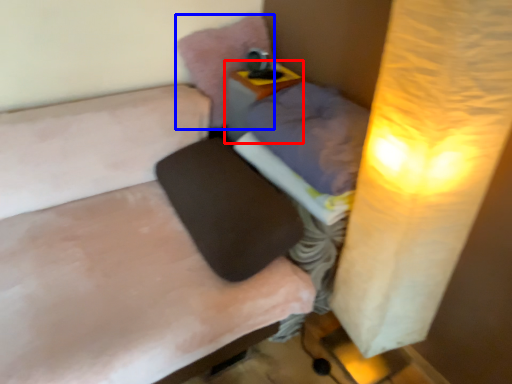
Question: Which of the following is the farthest to the observer, table (highlighted by a red box) or pillow (highlighted by a blue box)?

Choices:
 (A) table
 (B) pillow

Answer: (B)